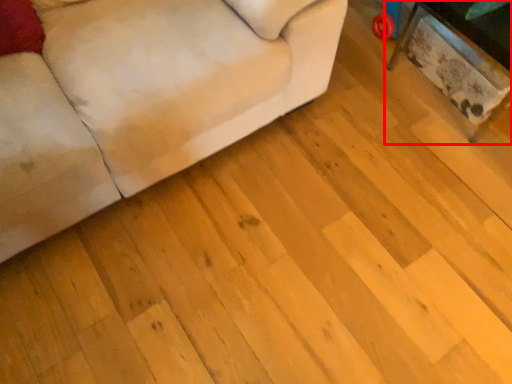
Question: From the image's perspective, where is table (annotated by the red box) located in relation to studio couch in the image?

Choices:
 (A) below
 (B) above

Answer: (B)